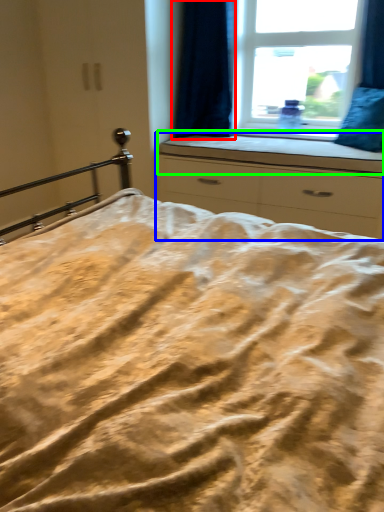
Question: Considering the real-world distances, which object is closest to curtain (highlighted by a red box)? chest of drawers (highlighted by a blue box) or window sill (highlighted by a green box).

Choices:
 (A) chest of drawers
 (B) window sill

Answer: (B)